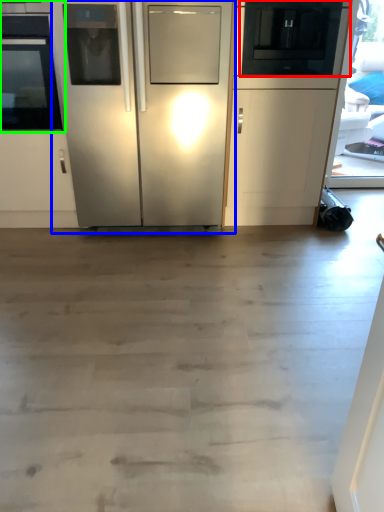
Question: Which object is positioned closest to appliance (highlighted by a red box)? Select from refrigerator (highlighted by a blue box) and oven (highlighted by a green box).

Choices:
 (A) refrigerator
 (B) oven

Answer: (A)